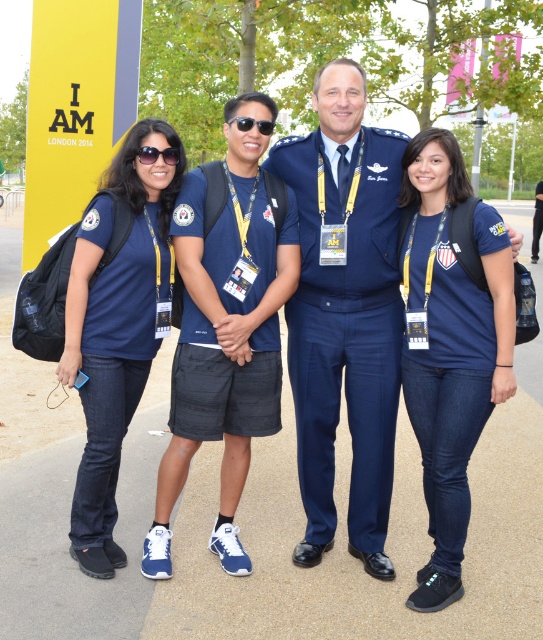
Looking at this image, you are a photographer at the event and want to ensure all foreground individuals are in focus. The matte blue shirt at left and sunglasses at center are in your frame. Considering their heights, which object should you adjust your focus on first to ensure both are clear?

The matte blue shirt at left has a greater height compared to sunglasses at center. To ensure both are in focus, adjust focus on the matte blue shirt at left first since it is taller and likely farther away, ensuring depth of field covers both.